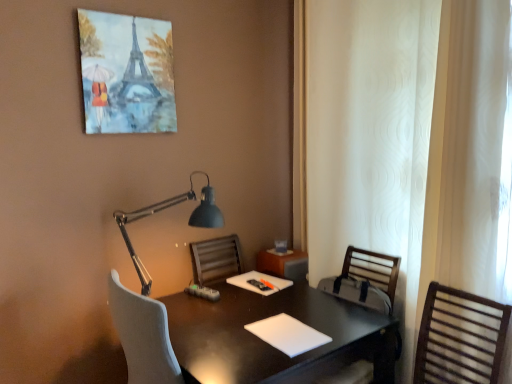
This screenshot has width=512, height=384. Find the location of `vacant space behind white matte notepad at center, positioned as the 2th notepad in back-to-front order`. vacant space behind white matte notepad at center, positioned as the 2th notepad in back-to-front order is located at coordinates (285, 305).